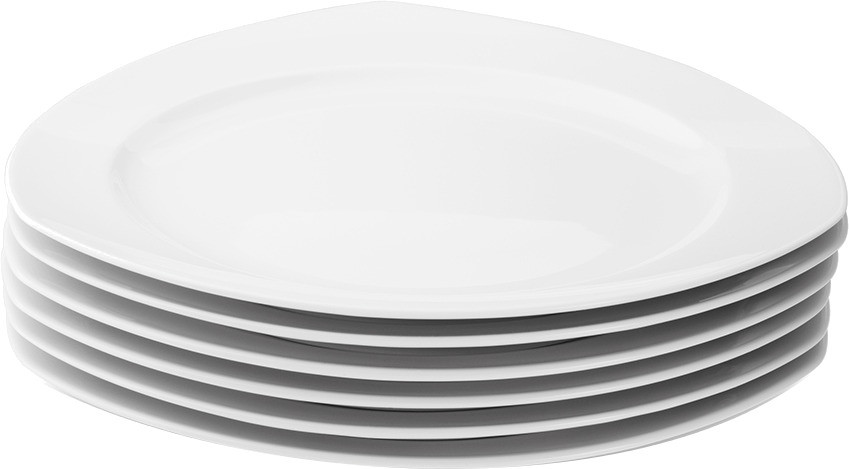
Where is `plates`? plates is located at coordinates tap(453, 265), tap(505, 338), tap(514, 370), tap(519, 391), tap(529, 423).